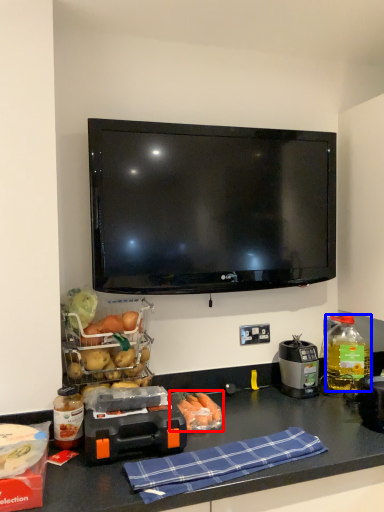
Question: Which object appears farthest to the camera in this image, food (highlighted by a red box) or bottle (highlighted by a blue box)?

Choices:
 (A) food
 (B) bottle

Answer: (B)